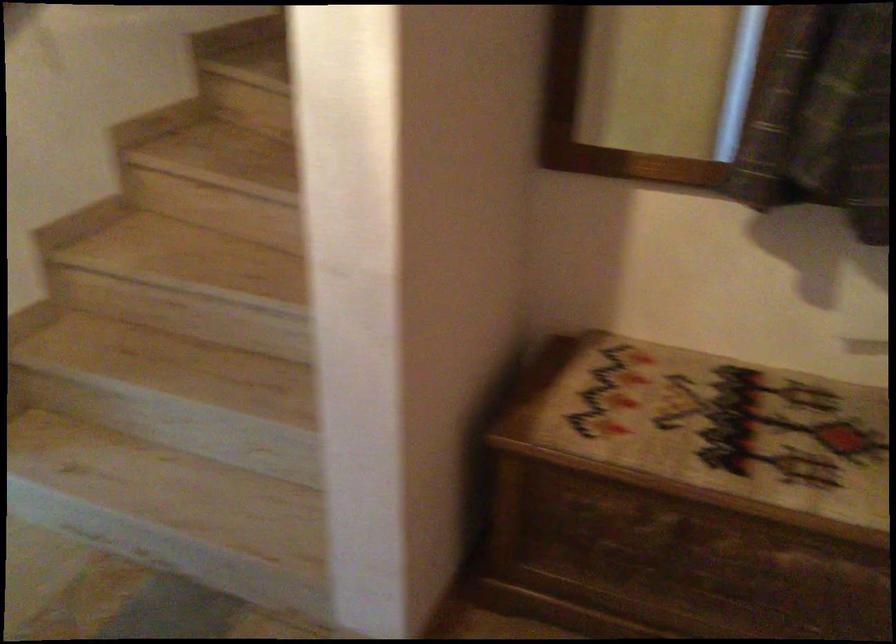
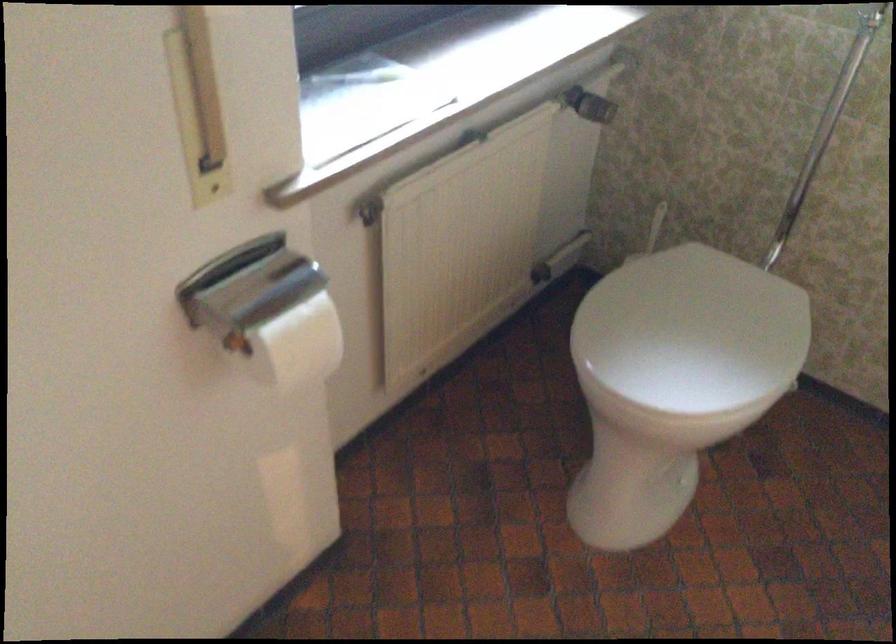
The images are taken continuously from a first-person perspective. In which direction are you moving?

The cameraman moved toward left, forward.